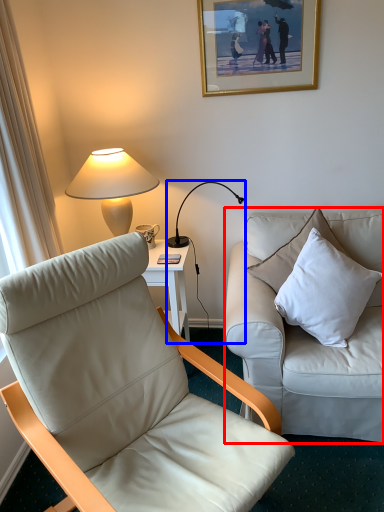
Question: Among these objects, which one is nearest to the camera, studio couch (highlighted by a red box) or lamp (highlighted by a blue box)?

Choices:
 (A) studio couch
 (B) lamp

Answer: (A)